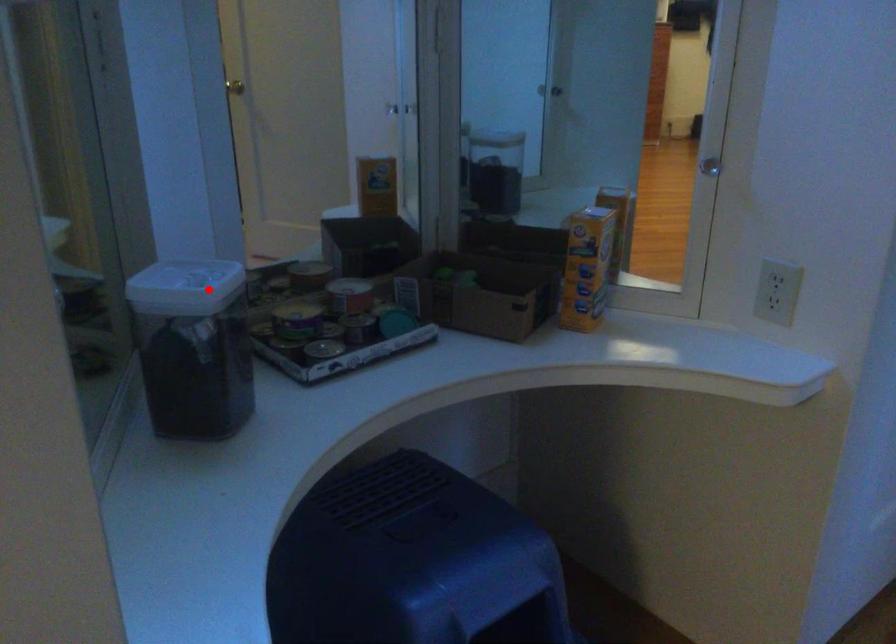
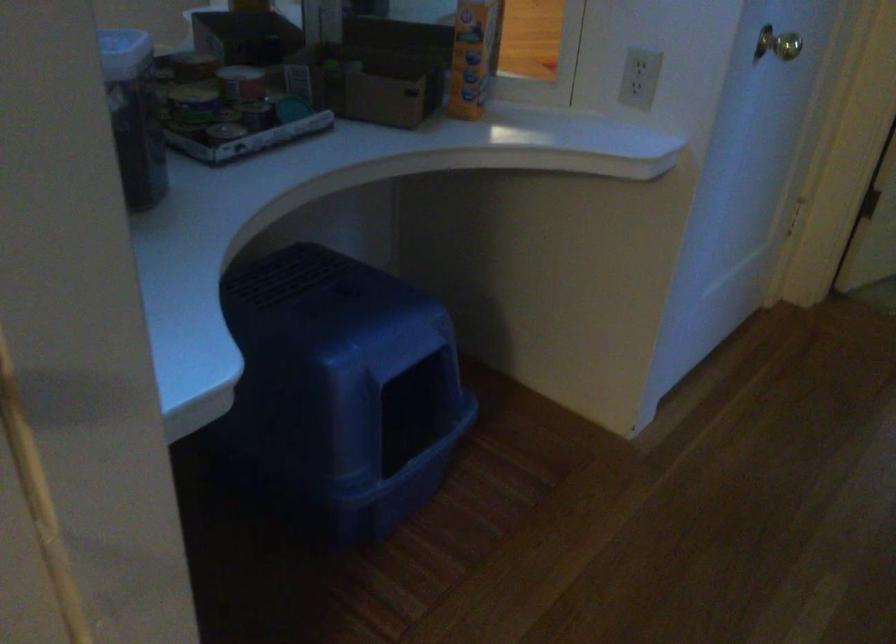
Locate, in the second image, the point that corresponds to the highlighted location in the first image.

(124, 53)